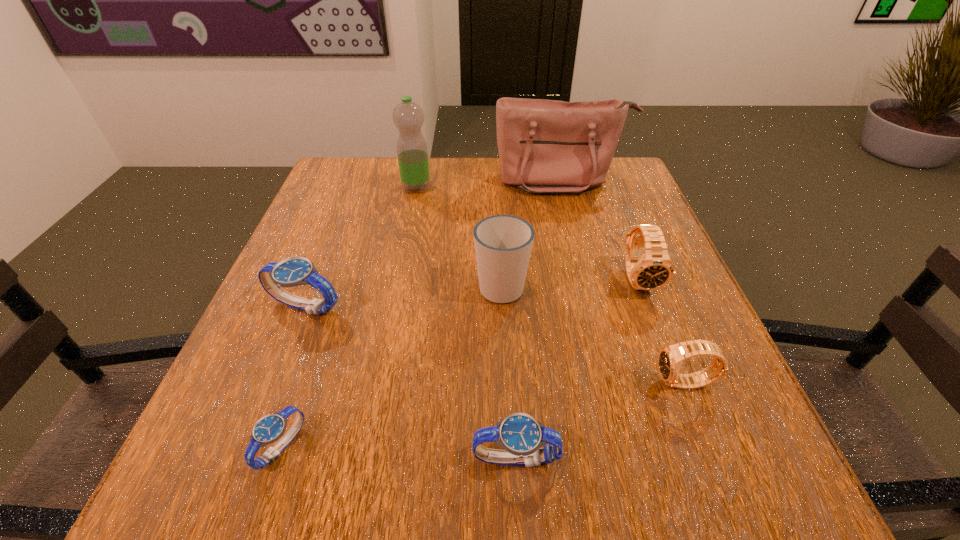
I want to click on vacant area at the near edge, so click(x=366, y=461).

At what (x,y) coordinates should I click in order to perform the action: click on vacant area at the left edge. Please return your answer as a coordinate pair (x, y). Looking at the image, I should click on (364, 207).

Where is `vacant space at the right edge of the desktop`? The width and height of the screenshot is (960, 540). vacant space at the right edge of the desktop is located at coordinates (592, 207).

Image resolution: width=960 pixels, height=540 pixels. I want to click on vacant space at the far left corner, so click(324, 181).

Find the location of a particular element. free space at the near right corner of the desktop is located at coordinates (746, 455).

Where is `vacant space that is in between the biggest blue watch and the farther black watch`? This screenshot has width=960, height=540. vacant space that is in between the biggest blue watch and the farther black watch is located at coordinates (471, 293).

This screenshot has height=540, width=960. Find the location of `free spot between the shortest watch and the third farthest watch`. free spot between the shortest watch and the third farthest watch is located at coordinates (483, 415).

Find the location of a particular element. vacant area between the third farthest watch and the third object from left to right is located at coordinates (551, 286).

Where is `vacant area that lies between the sixth object from right to left and the white cup`? This screenshot has width=960, height=540. vacant area that lies between the sixth object from right to left and the white cup is located at coordinates (459, 237).

At what (x,y) coordinates should I click in order to perform the action: click on empty location between the white cup and the biggest blue watch. Please return your answer as a coordinate pair (x, y). This screenshot has width=960, height=540. Looking at the image, I should click on (403, 296).